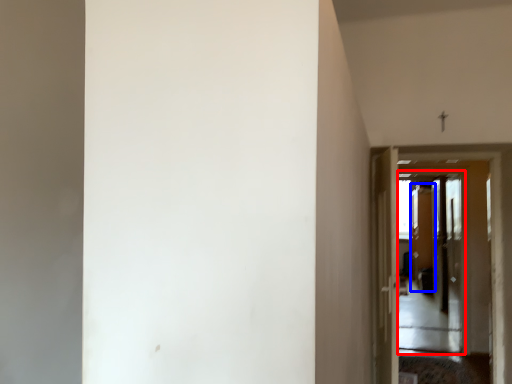
Question: Which of the following is the closest to the observer, screen door (highlighted by a red box) or screen door (highlighted by a blue box)?

Choices:
 (A) screen door
 (B) screen door

Answer: (A)